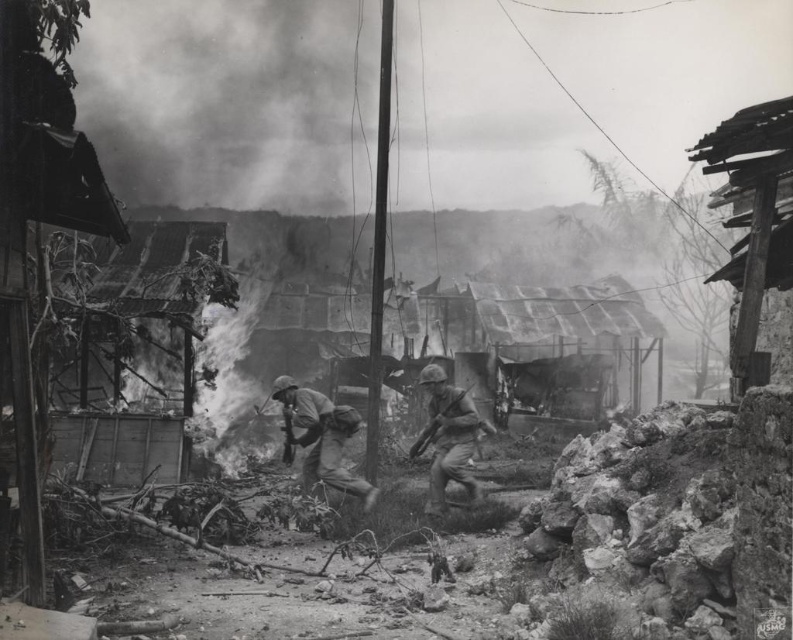
Does rusty corrugated metal hut at right have a lesser width compared to camouflage fabric uniform at center?

Incorrect, rusty corrugated metal hut at right's width is not less than camouflage fabric uniform at center's.

Does rusty corrugated metal hut at right have a greater width compared to camouflage fabric uniform at center?

Yes.

Does point (757, 376) come farther from viewer compared to point (299, 394)?

That is False.

The height and width of the screenshot is (640, 793). Identify the location of rusty corrugated metal hut at right. (753, 218).

Who is taller, rusty corrugated metal hut at right or camouflage fabric helmet at center?

Standing taller between the two is rusty corrugated metal hut at right.

Where is `rusty corrugated metal hut at right`? rusty corrugated metal hut at right is located at coordinates (753, 218).

Is camouflage fabric uniform at center to the left of camouflage fabric helmet at center from the viewer's perspective?

Yes, camouflage fabric uniform at center is to the left of camouflage fabric helmet at center.

Is camouflage fabric uniform at center wider than camouflage fabric helmet at center?

Yes.

Find the location of a particular element. The width and height of the screenshot is (793, 640). camouflage fabric uniform at center is located at coordinates (320, 436).